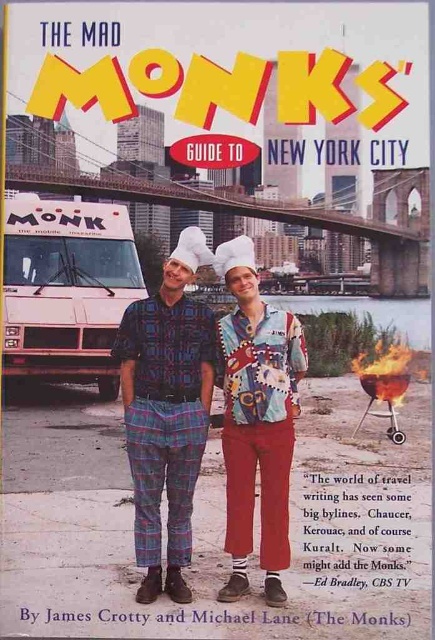
What type of pants are located at the coordinates point (233,396) on the book cover?

The pants at point (233,396) are plaid fabric pants at center.

You are a delivery person who needs to load a white plastic food truck at left onto a truck that has a height limit of 1.5 meters. Given that the printed fabric chef hat at center is 1.8 meters tall, can the food truck be loaded without removing the chef hat?

The white plastic food truck at left is not as tall as the printed fabric chef hat at center, which is 1.8 meters tall. Since the food truck is shorter than the chef hat, it is under the 1.5 meter height limit and can be loaded safely.